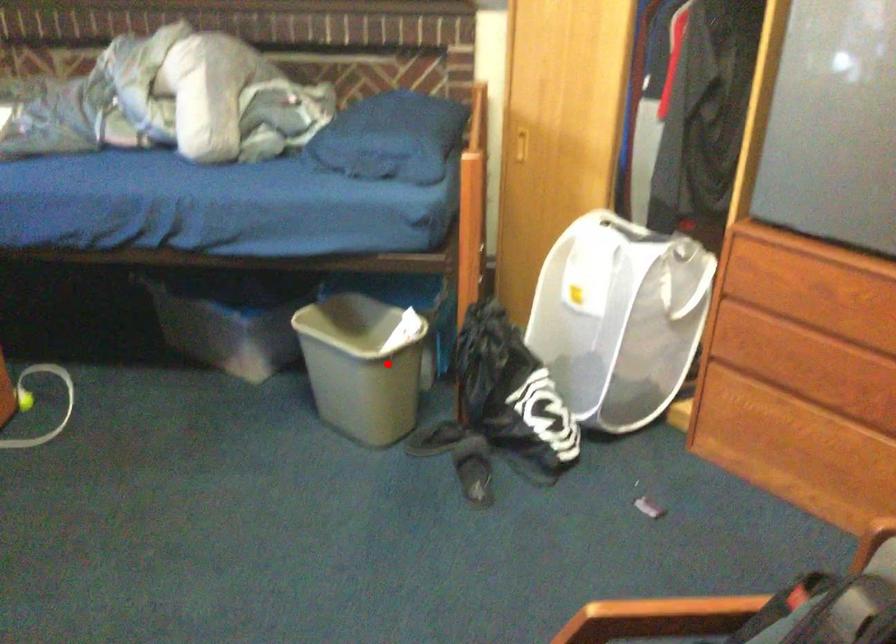
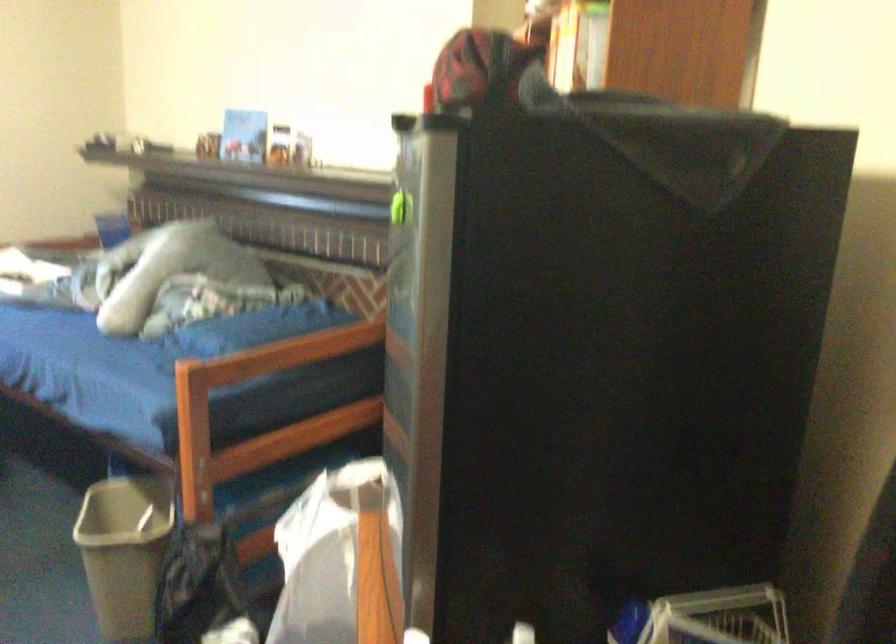
Locate, in the second image, the point that corresponds to the highlighted location in the first image.

(124, 552)